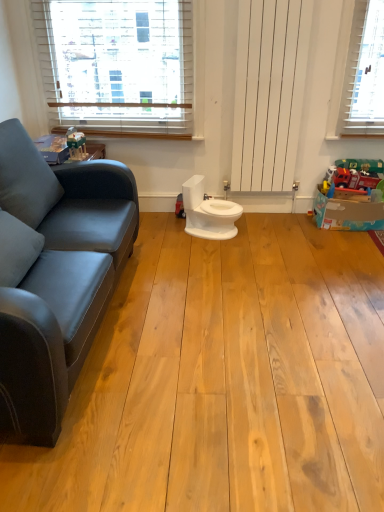
Identify the location of vacant area to the right of white glossy toilet at center. This screenshot has width=384, height=512. (258, 229).